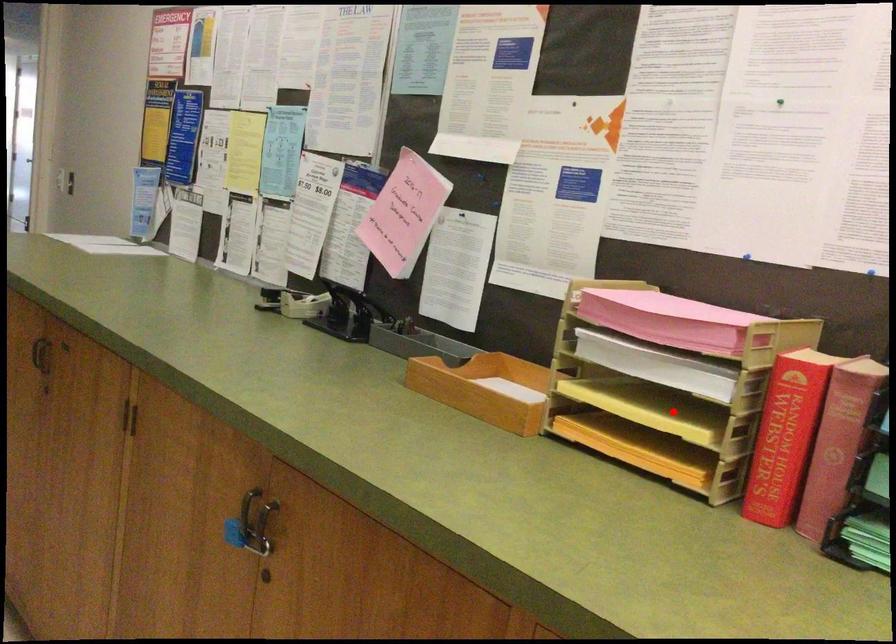
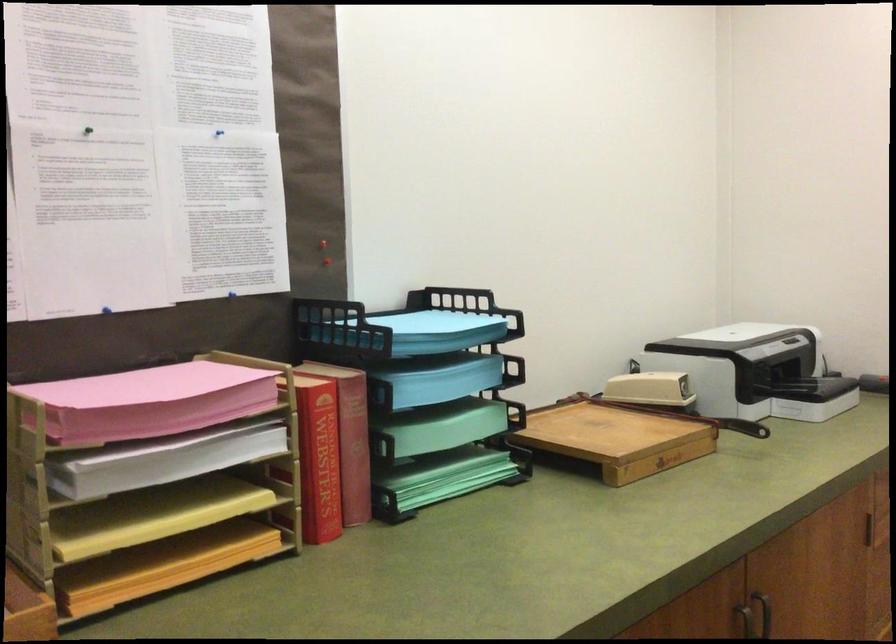
Question: I am providing you with two images of the same scene from different viewpoints. A red point is shown in image1. For the corresponding object point in image2, is it positioned nearer or farther from the camera?

Choices:
 (A) Nearer
 (B) Farther

Answer: (A)